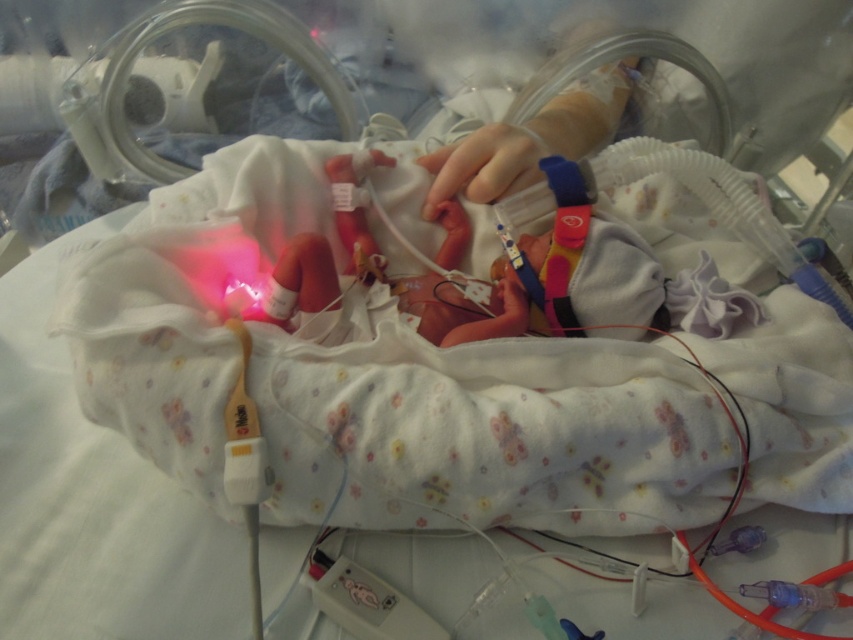
You are a nurse in the neonatal intensive care unit. You need to determine if the smooth skin newborn at center can fit entirely within the incubator while keeping their smooth skin hand at center visible outside. Based on the size comparison between the two, what would you advise?

The smooth skin newborn at center is wider than the smooth skin hand at center, so the newborn cannot fit entirely within the incubator while keeping the hand visible outside.

In the medical scene described, there is a smooth skin newborn at center and a smooth skin hand at center. Which object is located to the right side?

The smooth skin hand at center is located to the right side of the smooth skin newborn at center.